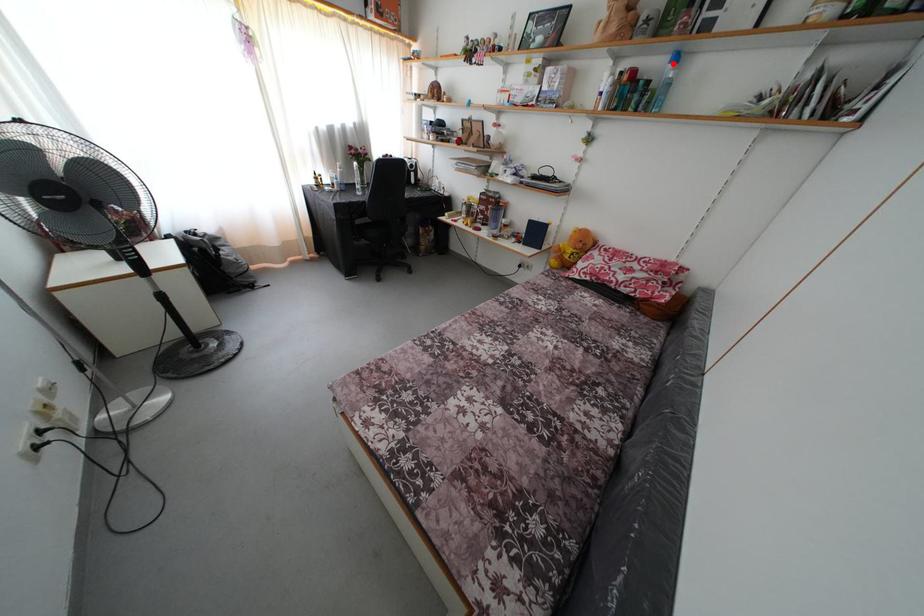
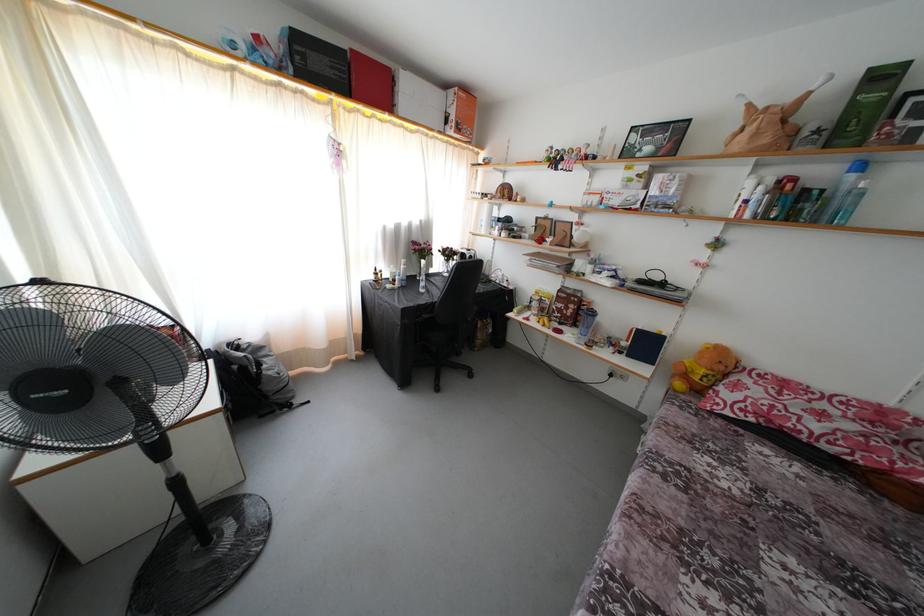
Where in the second image is the point corresponding to the highlighted location from the first image?

(849, 172)